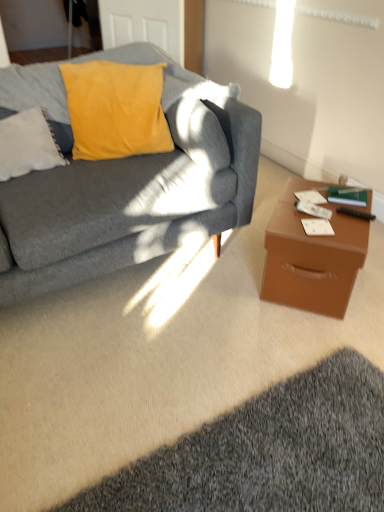
The width and height of the screenshot is (384, 512). Find the location of `brown leather desk at right`. brown leather desk at right is located at coordinates (312, 257).

Where is `white fluffy pillow at upper left`? white fluffy pillow at upper left is located at coordinates coord(27,144).

I want to click on black plastic remote control at right, so click(356, 213).

Identify the location of matte gray couch at left. (131, 192).

Where is `brown leather desk at right`? The width and height of the screenshot is (384, 512). brown leather desk at right is located at coordinates (312, 257).

From a real-world perspective, is dark gray shaggy rug at lower right positioned under matte gray couch at left based on gravity?

Yes, from a real-world perspective, dark gray shaggy rug at lower right is below matte gray couch at left.

Does dark gray shaggy rug at lower right have a lesser width compared to matte gray couch at left?

Indeed, dark gray shaggy rug at lower right has a lesser width compared to matte gray couch at left.

Considering the relative sizes of dark gray shaggy rug at lower right and brown leather desk at right in the image provided, is dark gray shaggy rug at lower right shorter than brown leather desk at right?

Yes.

Which object is further away from the camera taking this photo, dark gray shaggy rug at lower right or brown leather desk at right?

brown leather desk at right.

From the image's perspective, which is below, dark gray shaggy rug at lower right or brown leather desk at right?

dark gray shaggy rug at lower right.

How distant is dark gray shaggy rug at lower right from brown leather desk at right?

They are 22.30 inches apart.

From the image's perspective, is black plastic remote control at right over white fluffy pillow at upper left?

No, from the image's perspective, black plastic remote control at right is not above white fluffy pillow at upper left.

Is black plastic remote control at right directly adjacent to white fluffy pillow at upper left?

They are not placed beside each other.

Considering the sizes of black plastic remote control at right and white fluffy pillow at upper left in the image, is black plastic remote control at right bigger or smaller than white fluffy pillow at upper left?

black plastic remote control at right is smaller than white fluffy pillow at upper left.

Who is smaller, matte gray couch at left or white fluffy pillow at upper left?

white fluffy pillow at upper left.

In order to click on pillow on the left of the matte gray couch at left in this screenshot , I will do `click(27, 144)`.

Is point (120, 236) farther from camera compared to point (41, 136)?

No, (120, 236) is closer to viewer.

Is green matte book at right situated inside brown leather desk at right or outside?

green matte book at right lies within the bounds of brown leather desk at right.

Considering the sizes of green matte book at right and brown leather desk at right in the image, is green matte book at right wider or thinner than brown leather desk at right?

Considering their sizes, green matte book at right looks slimmer than brown leather desk at right.

Could you tell me if green matte book at right is facing brown leather desk at right?

No, green matte book at right is not oriented towards brown leather desk at right.

Does black plastic remote control at right have a lesser width compared to green matte book at right?

Indeed, black plastic remote control at right has a lesser width compared to green matte book at right.

Which object is more forward, black plastic remote control at right or green matte book at right?

black plastic remote control at right is more forward.

From a real-world perspective, between black plastic remote control at right and green matte book at right, who is vertically higher?

black plastic remote control at right.

Can you confirm if black plastic remote control at right is shorter than brown leather desk at right?

Yes, black plastic remote control at right is shorter than brown leather desk at right.

Is black plastic remote control at right far from brown leather desk at right?

No, black plastic remote control at right is not far from brown leather desk at right.

Is point (352, 213) positioned before point (295, 187)?

Yes, point (352, 213) is in front of point (295, 187).

This screenshot has width=384, height=512. Find the location of `remote control on the right of brown leather desk at right`. remote control on the right of brown leather desk at right is located at coordinates (356, 213).

Image resolution: width=384 pixels, height=512 pixels. I want to click on mat directly beneath the matte gray couch at left (from a real-world perspective), so click(x=268, y=452).

I want to click on mat in front of the brown leather desk at right, so click(268, 452).

Looking at the image, which one is located further to black plastic remote control at right, matte gray couch at left or brown leather desk at right?

The object further to black plastic remote control at right is matte gray couch at left.

When comparing their distances from white fluffy pillow at upper left, does brown leather desk at right or matte gray couch at left seem further?

brown leather desk at right is positioned further to the anchor white fluffy pillow at upper left.

Estimate the real-world distances between objects in this image. Which object is further from dark gray shaggy rug at lower right, matte gray couch at left or black plastic remote control at right?

black plastic remote control at right.

Estimate the real-world distances between objects in this image. Which object is further from white fluffy pillow at upper left, black plastic remote control at right or green matte book at right?

black plastic remote control at right.

Estimate the real-world distances between objects in this image. Which object is further from brown leather desk at right, black plastic remote control at right or green matte book at right?

green matte book at right lies further to brown leather desk at right than the other object.

Considering their positions, is matte gray couch at left positioned further to black plastic remote control at right than green matte book at right?

matte gray couch at left.

Looking at the image, which one is located closer to brown leather desk at right, dark gray shaggy rug at lower right or green matte book at right?

green matte book at right is positioned closer to the anchor brown leather desk at right.

Which object lies nearer to the anchor point brown leather desk at right, white fluffy pillow at upper left or dark gray shaggy rug at lower right?

Based on the image, dark gray shaggy rug at lower right appears to be nearer to brown leather desk at right.

Find the location of a particular element. The height and width of the screenshot is (512, 384). desk between matte gray couch at left and dark gray shaggy rug at lower right in the up-down direction is located at coordinates (312, 257).

Identify the location of remote control between brown leather desk at right and green matte book at right in the front-back direction. (356, 213).

This screenshot has height=512, width=384. Find the location of `pillow between matte gray couch at left and dark gray shaggy rug at lower right vertically`. pillow between matte gray couch at left and dark gray shaggy rug at lower right vertically is located at coordinates pos(27,144).

Image resolution: width=384 pixels, height=512 pixels. Identify the location of desk situated between matte gray couch at left and black plastic remote control at right from left to right. (312, 257).